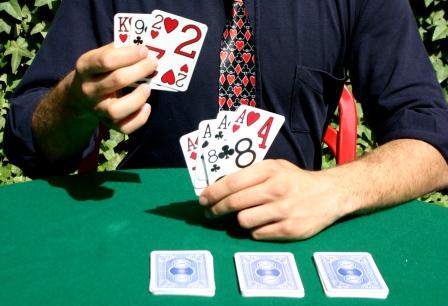
Locate an element on the screen. plant is located at coordinates (41, 291), (40, 12).